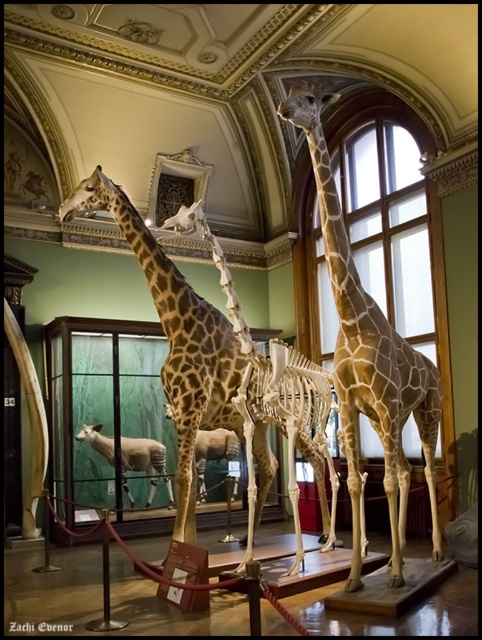
You are an art curator planning to move the white woolen sheep at center to the left side of the room. Considering the light brown spotted giraffe at center is in the way, can you move the sheep without moving the giraffe?

The light brown spotted giraffe at center is wider than the white woolen sheep at center. Since the giraffe is in the way and occupies more space, moving the sheep around it might be challenging. However, if there is enough space on either side of the giraffe, the sheep could be moved to the left by navigating around the giraffe.

You are an art curator arranging a new exhibit. You have a brown spotted giraffe at center and a white woolen sheep at center. Which animal would require more horizontal space due to its width?

The brown spotted giraffe at center requires more horizontal space because its width surpasses that of the white woolen sheep at center.

You are standing in the museum and see the brown spotted giraffe at center and the white woolen sheep at center. Which one is positioned to the right side of the other?

The brown spotted giraffe at center is to the right of the white woolen sheep at center.